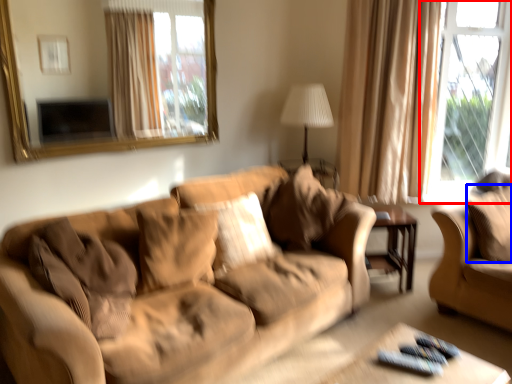
Question: Which object appears closest to the camera in this image, window (highlighted by a red box) or pillow (highlighted by a blue box)?

Choices:
 (A) window
 (B) pillow

Answer: (B)